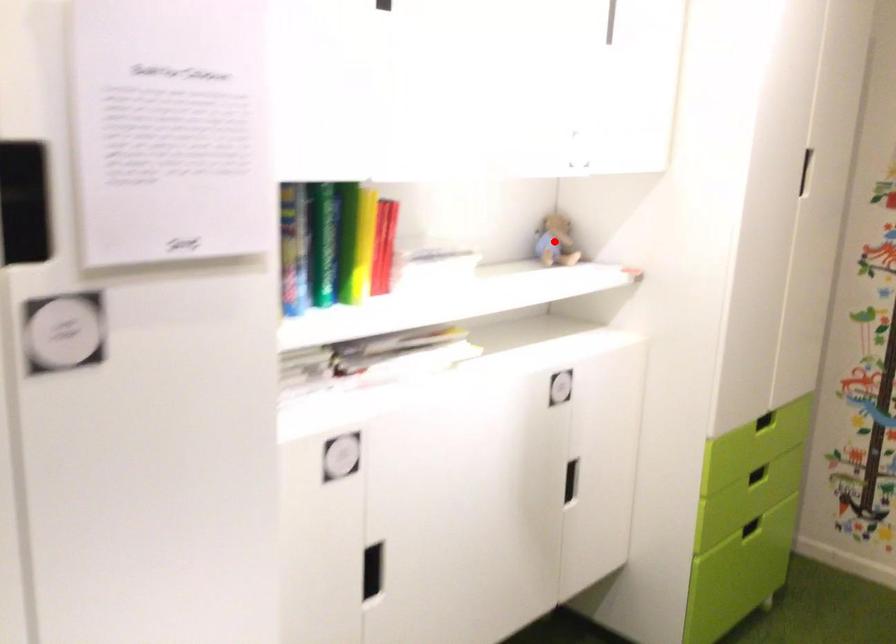
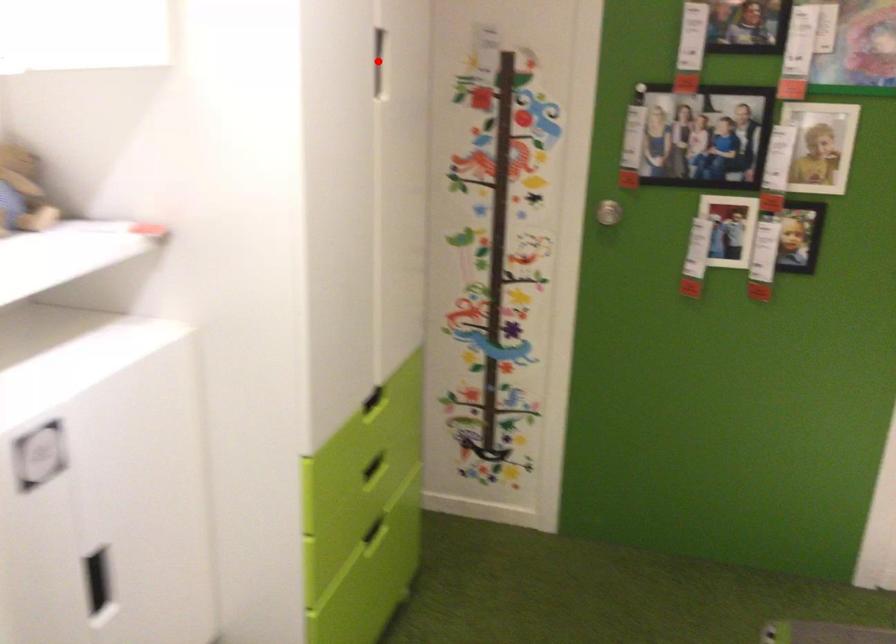
I am providing you with two images of the same scene from different viewpoints. A red point is marked on the first image and another point is marked on the second image. Is the marked point in image1 the same physical position as the marked point in image2?

No